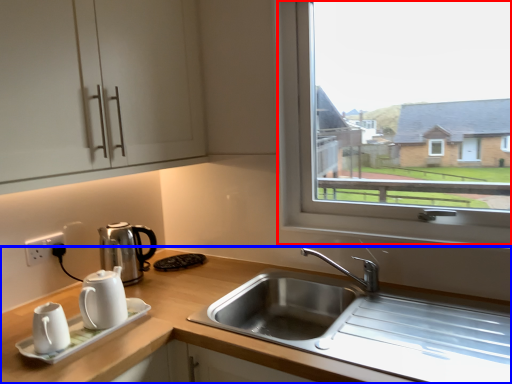
Question: Which object appears closest to the camera in this image, window (highlighted by a red box) or countertop (highlighted by a blue box)?

Choices:
 (A) window
 (B) countertop

Answer: (B)